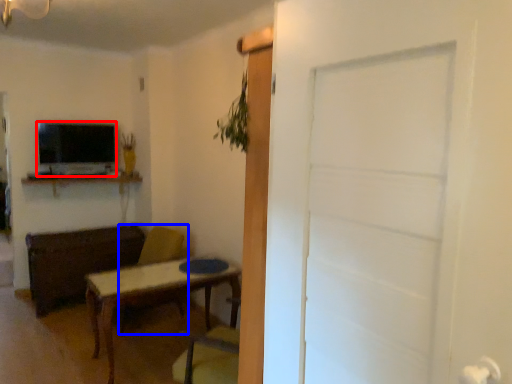
Question: Which object is closer to the camera taking this photo, television (highlighted by a red box) or swivel chair (highlighted by a blue box)?

Choices:
 (A) television
 (B) swivel chair

Answer: (B)